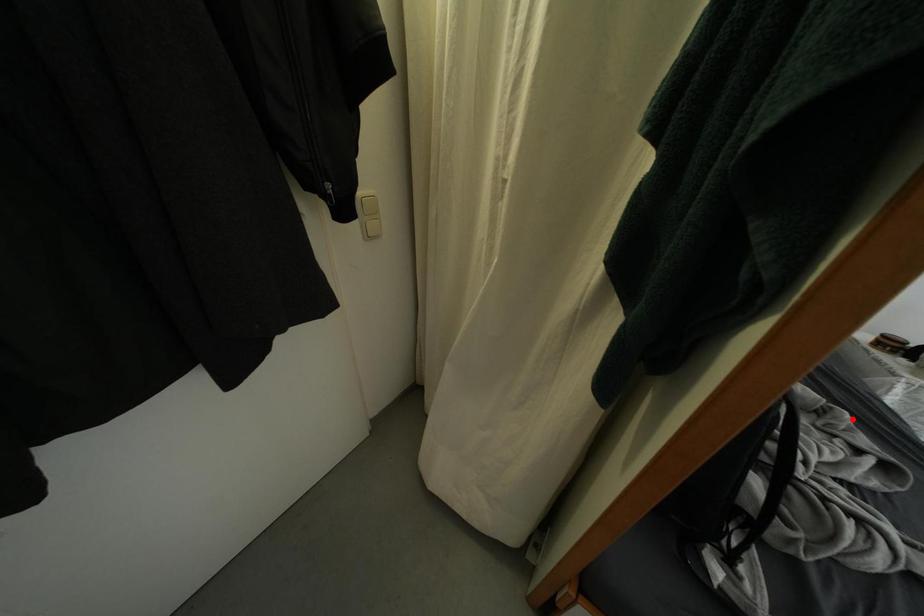
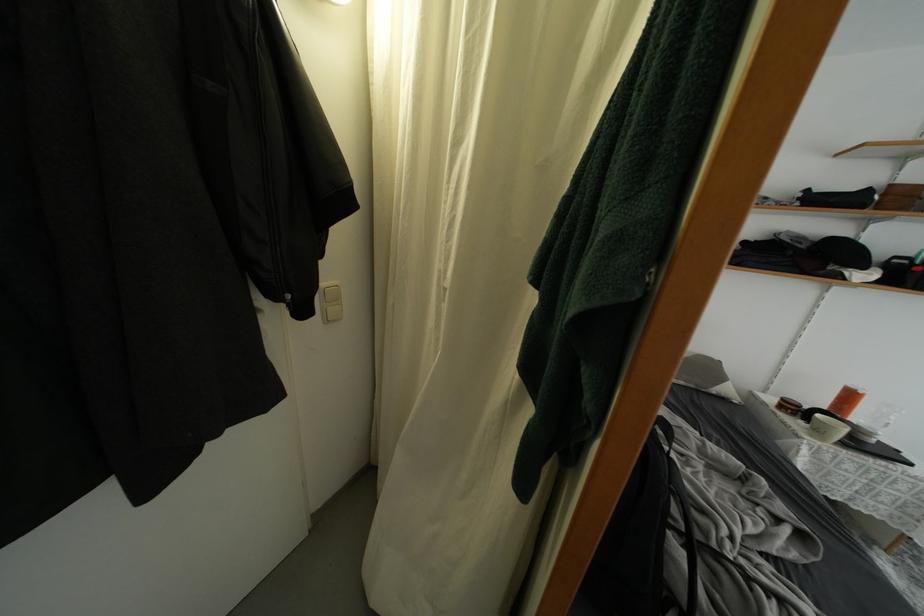
Question: I am providing you with two images of the same scene from different viewpoints. Given a red point in image1, look at the same physical point in image2. Is it:

Choices:
 (A) Closer to the viewpoint
 (B) Farther from the viewpoint

Answer: (B)